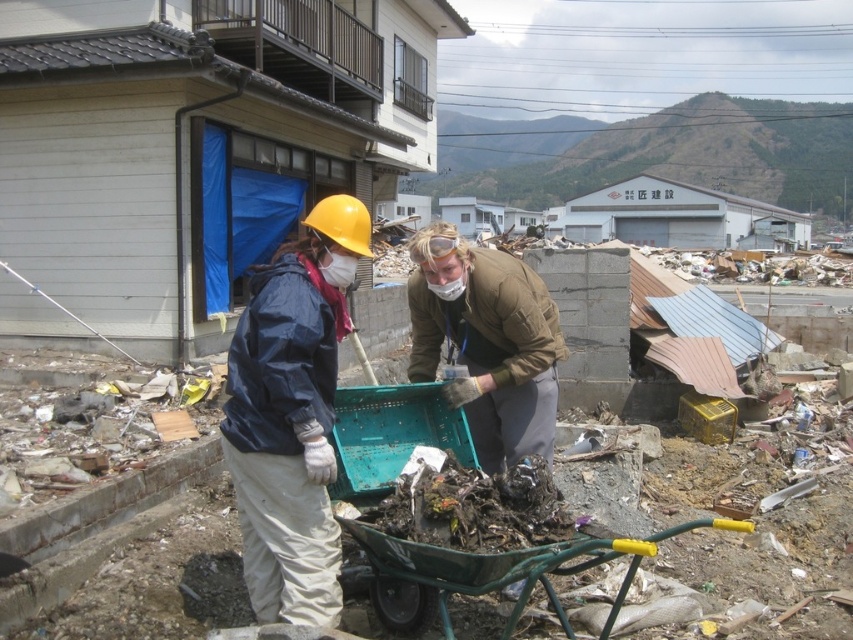
Question: Is brown leather jacket at center further to the viewer compared to green plastic cart at lower center?

Choices:
 (A) no
 (B) yes

Answer: (B)

Question: Can you confirm if matte blue jacket at center is positioned to the left of matte yellow hard hat at center?

Choices:
 (A) no
 (B) yes

Answer: (A)

Question: Observing the image, what is the correct spatial positioning of matte blue jacket at center in reference to green plastic cart at lower center?

Choices:
 (A) below
 (B) above

Answer: (B)

Question: Which of the following is the farthest from the observer?

Choices:
 (A) (241, 394)
 (B) (352, 532)

Answer: (B)

Question: Estimate the real-world distances between objects in this image. Which object is closer to the green plastic cart at lower center?

Choices:
 (A) matte blue jacket at center
 (B) brown leather jacket at center
 (C) matte yellow hard hat at center

Answer: (A)

Question: Which object is the closest to the matte yellow hard hat at center?

Choices:
 (A) green plastic cart at lower center
 (B) brown leather jacket at center
 (C) matte blue jacket at center

Answer: (C)